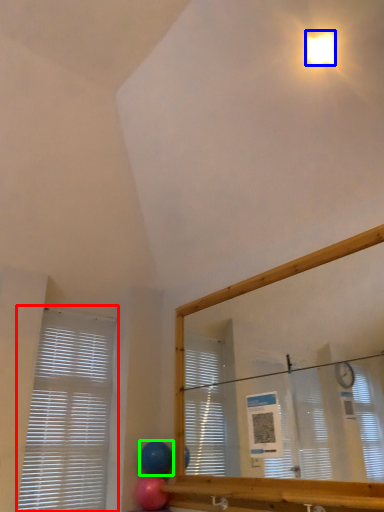
Question: Which object is positioned farthest from window blind (highlighted by a red box)? Select from light (highlighted by a blue box) and balloon (highlighted by a green box).

Choices:
 (A) light
 (B) balloon

Answer: (A)